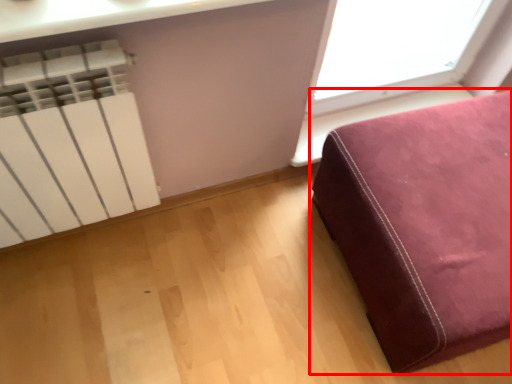
Question: From the image's perspective, where is furniture (annotated by the red box) located relative to radiator?

Choices:
 (A) below
 (B) above

Answer: (A)